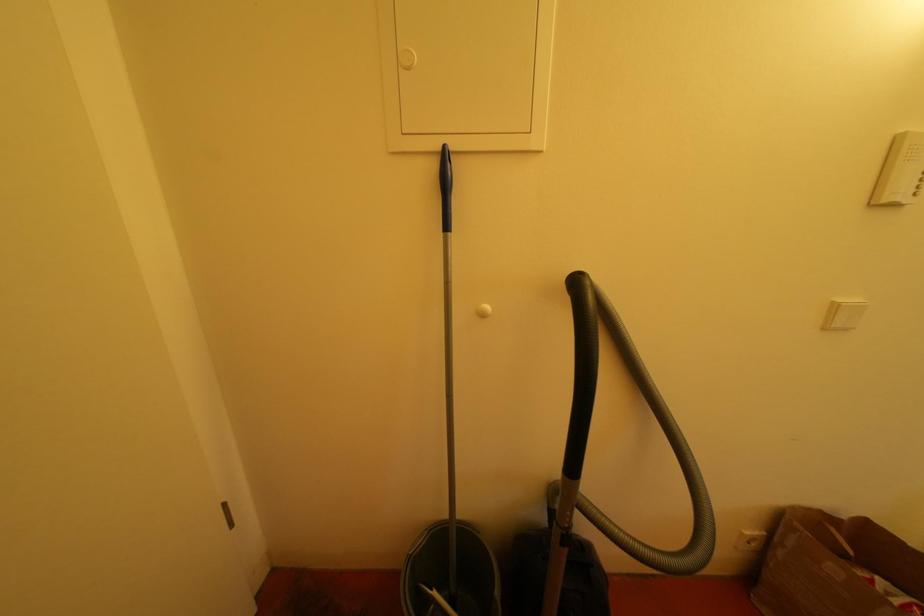
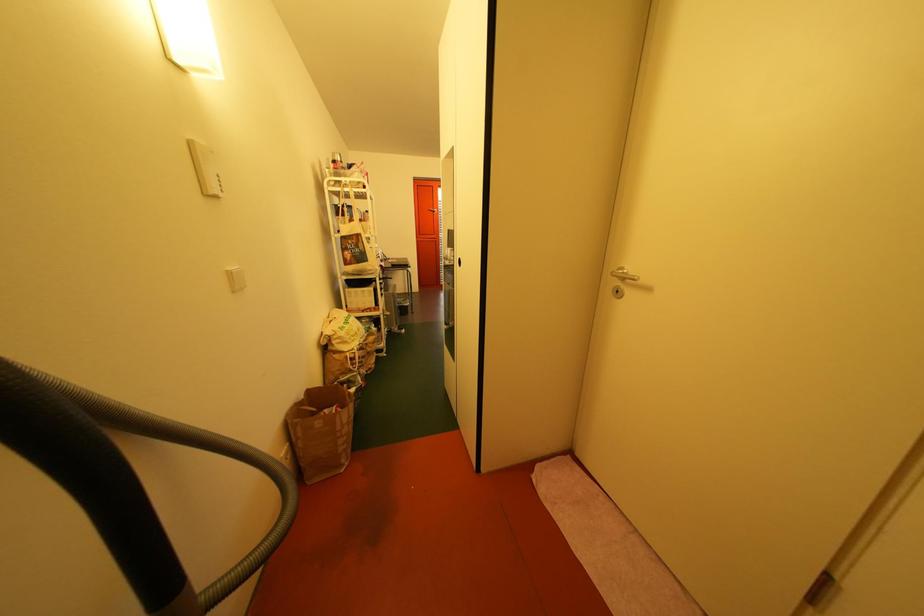
The images are taken continuously from a first-person perspective. In which direction is your viewpoint rotating?

The camera's rotation is toward right-down.